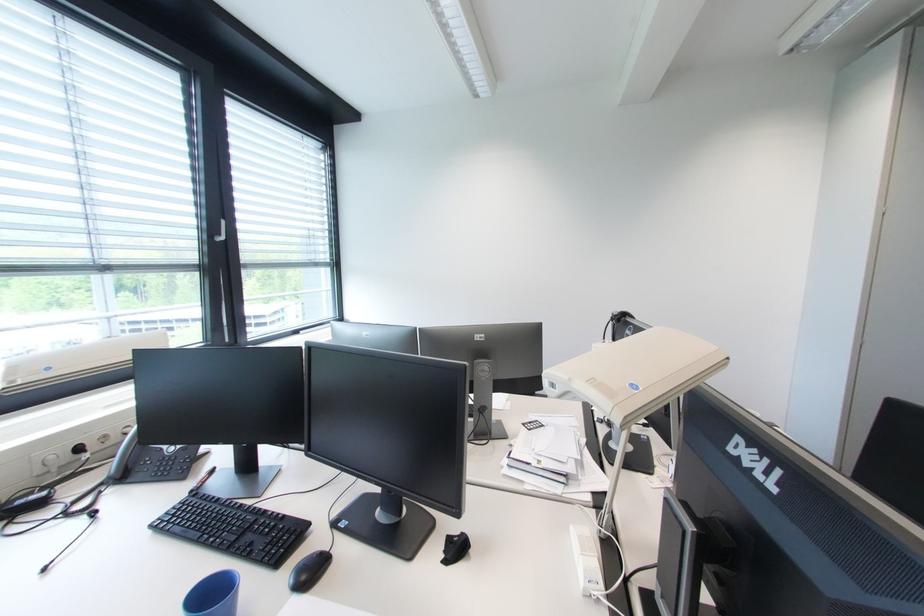
The location [309,570] corresponds to which object?

It refers to a black computer mouse.